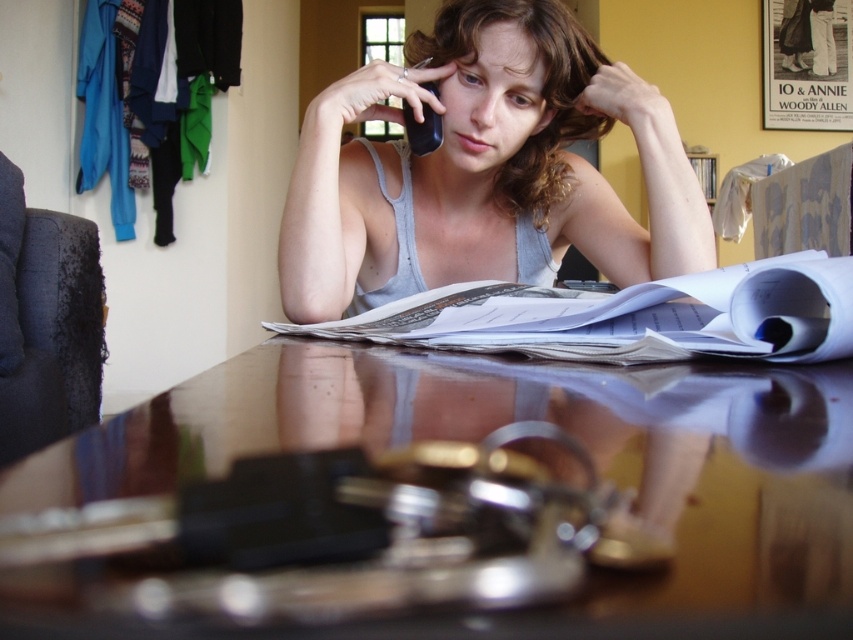
Question: Which point is farther to the camera?

Choices:
 (A) (773, 589)
 (B) (383, 196)

Answer: (B)

Question: Can you confirm if glossy wooden table at center is smaller than gray cotton tank top at center?

Choices:
 (A) yes
 (B) no

Answer: (A)

Question: Does glossy wooden table at center have a smaller size compared to gray cotton tank top at center?

Choices:
 (A) yes
 (B) no

Answer: (A)

Question: Can you confirm if glossy wooden table at center is wider than gray cotton tank top at center?

Choices:
 (A) yes
 (B) no

Answer: (B)

Question: Among these points, which one is farthest from the camera?

Choices:
 (A) (436, 252)
 (B) (270, 426)

Answer: (A)